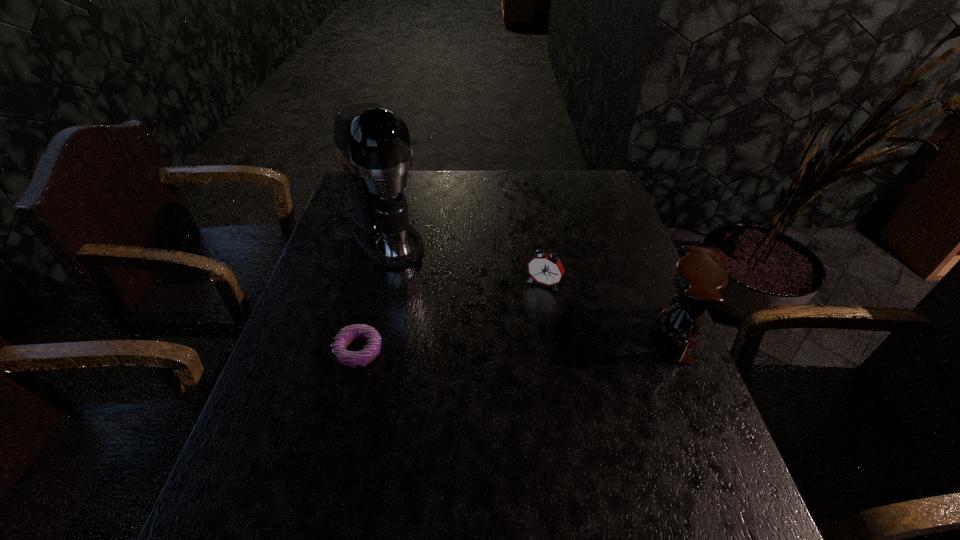
Locate an element on the screen. doughnut is located at coordinates (349, 359).

This screenshot has height=540, width=960. Identify the location of the third shortest object. pos(698,280).

Identify the location of the rightmost object. (698, 280).

The width and height of the screenshot is (960, 540). I want to click on the farthest object, so click(373, 143).

Locate an element on the screen. the tallest object is located at coordinates (373, 143).

Identify the location of the third nearest object. The height and width of the screenshot is (540, 960). (545, 269).

I want to click on the third tallest object, so click(545, 269).

The image size is (960, 540). I want to click on vacant region located 0.370m on the right of the shortest object, so click(x=541, y=352).

Where is `free space located on the back of the rightmost object`? This screenshot has width=960, height=540. free space located on the back of the rightmost object is located at coordinates (655, 289).

Where is `free space located 0.370m place cup under the spout of the farthest object`? This screenshot has width=960, height=540. free space located 0.370m place cup under the spout of the farthest object is located at coordinates (485, 343).